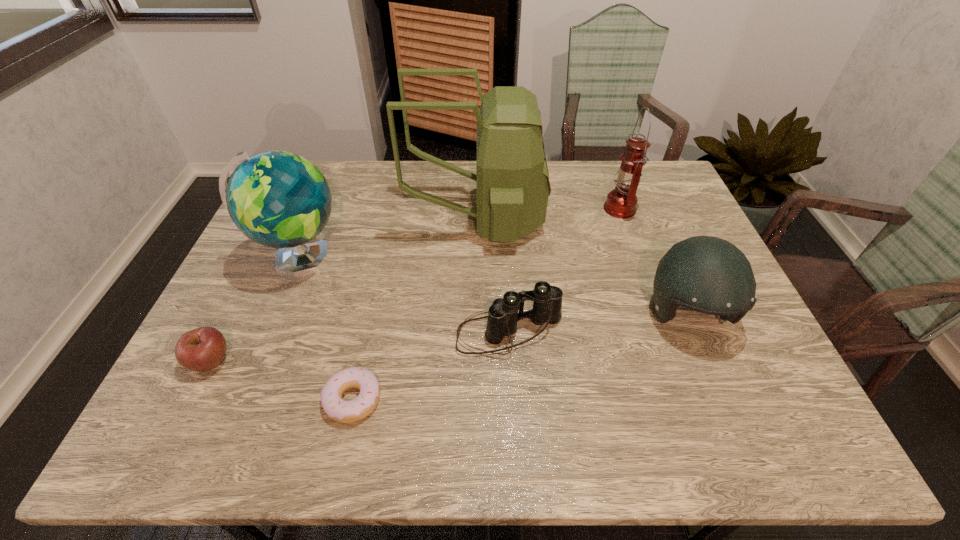
The width and height of the screenshot is (960, 540). Identify the location of football helmet that is at the right edge. (707, 274).

The image size is (960, 540). I want to click on object present at the far right corner, so click(x=621, y=202).

Locate an element on the screen. This screenshot has height=540, width=960. vacant area at the far edge is located at coordinates (614, 184).

Find the location of a particular element. free location at the near edge is located at coordinates (307, 448).

Identify the location of vacant space at the far right corner of the desktop. (665, 195).

In order to click on unoccupied position between the fourth tallest object and the sixth tallest object in this screenshot , I will do `click(449, 338)`.

At what (x,y) coordinates should I click in order to perform the action: click on empty space that is in between the backpack and the apple. Please return your answer as a coordinate pair (x, y). This screenshot has height=540, width=960. Looking at the image, I should click on (x=344, y=290).

At what (x,y) coordinates should I click in order to perform the action: click on free spot between the globe and the football helmet. Please return your answer as a coordinate pair (x, y). This screenshot has width=960, height=540. Looking at the image, I should click on (493, 287).

This screenshot has width=960, height=540. Identify the location of free point between the football helmet and the shortest object. (519, 357).

Where is `free area in between the globe and the shortest object`? Image resolution: width=960 pixels, height=540 pixels. free area in between the globe and the shortest object is located at coordinates (325, 329).